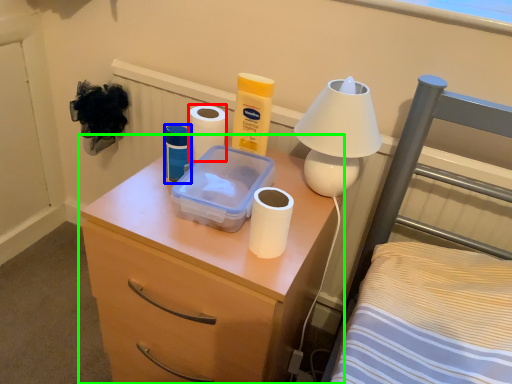
Question: Considering the real-world distances, which object is closest to toilet paper (highlighted by a red box)? toiletry (highlighted by a blue box) or nightstand (highlighted by a green box).

Choices:
 (A) toiletry
 (B) nightstand

Answer: (A)